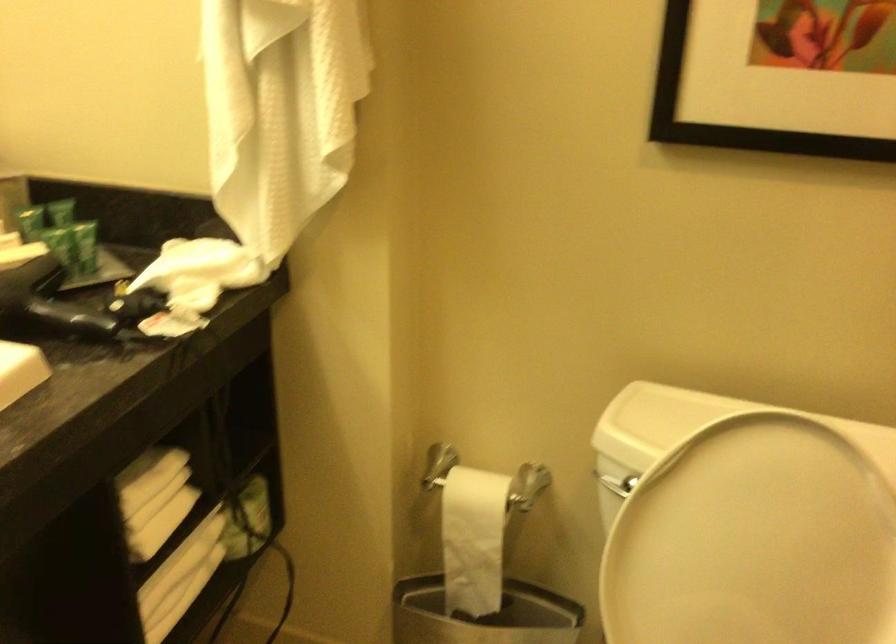
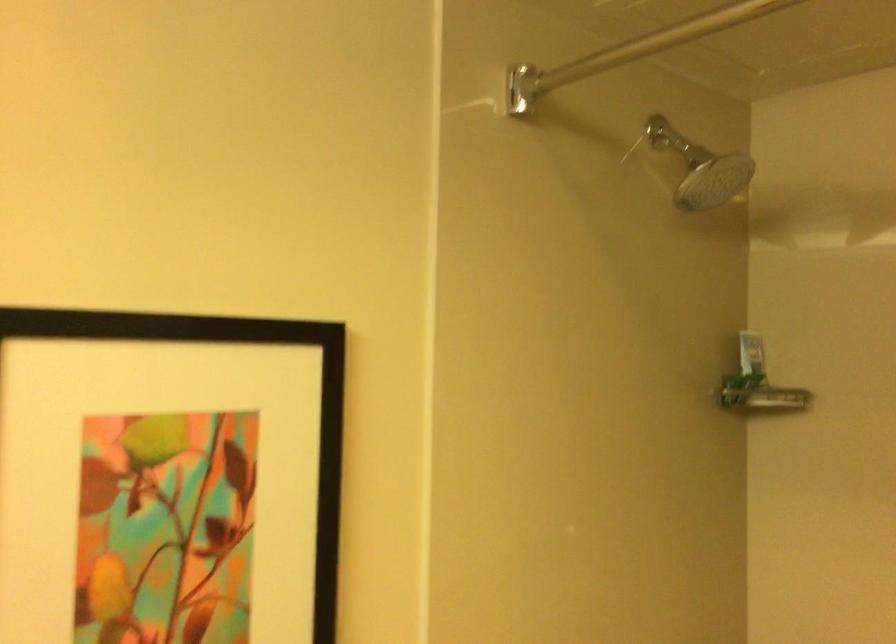
How did the camera likely rotate?

The camera's rotation is toward right-up.